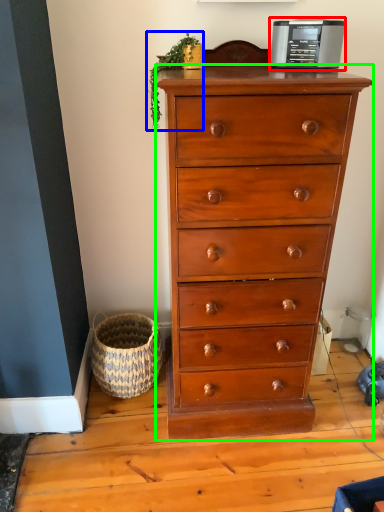
Question: Based on their relative distances, which object is nearer to appliance (highlighted by a red box)? Choose from plant (highlighted by a blue box) and chest of drawers (highlighted by a green box).

Choices:
 (A) plant
 (B) chest of drawers

Answer: (A)